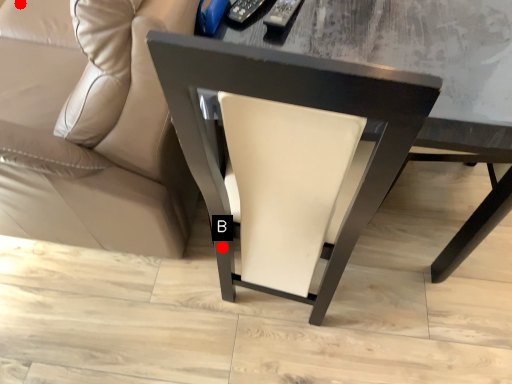
Question: Two points are circled on the image, labeled by A and B beside each circle. Which of the following is the closest to the observer?

Choices:
 (A) A is closer
 (B) B is closer

Answer: (B)